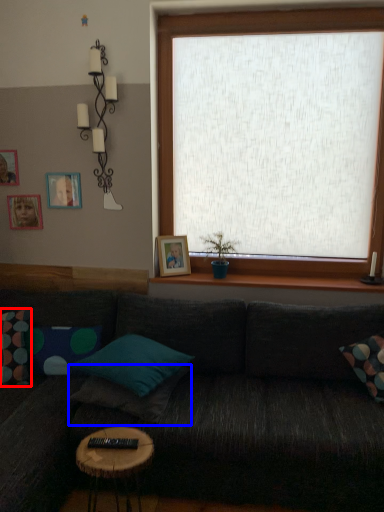
Question: Which point is closer to the camera, pillow (highlighted by a red box) or pillow (highlighted by a blue box)?

Choices:
 (A) pillow
 (B) pillow

Answer: (B)